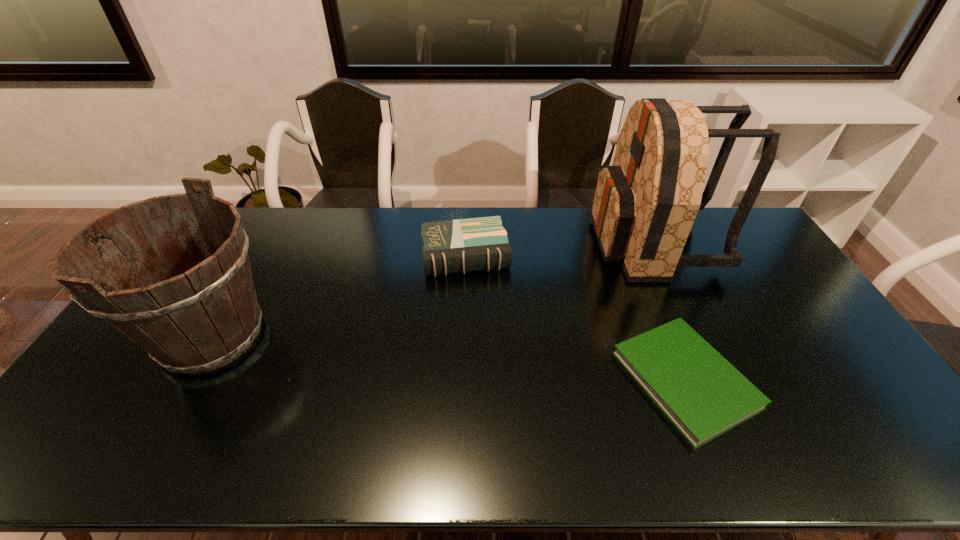
Identify the location of vacant space in between the tallest object and the bucket. (432, 289).

Where is `empty location between the right paperback book and the left paperback book`? This screenshot has height=540, width=960. empty location between the right paperback book and the left paperback book is located at coordinates (576, 317).

Locate an element on the screen. The image size is (960, 540). unoccupied position between the second tallest object and the second shortest object is located at coordinates point(339,295).

Identify the location of vacant region between the second tallest object and the right paperback book. (448, 357).

Where is `blank region between the bucket and the backpack`? blank region between the bucket and the backpack is located at coordinates (432, 289).

Identify the location of free space between the tallest object and the leftmost object. The image size is (960, 540). (432, 289).

Where is `unoccupied position between the second tallest object and the tallest object`? This screenshot has height=540, width=960. unoccupied position between the second tallest object and the tallest object is located at coordinates (432, 289).

Locate an element on the screen. vacant area between the leftmost object and the left paperback book is located at coordinates (339, 295).

Where is `vacant region between the second shortest object and the leftmost object`? vacant region between the second shortest object and the leftmost object is located at coordinates (339, 295).

Where is `object that can be found as the second closest to the backpack`? The width and height of the screenshot is (960, 540). object that can be found as the second closest to the backpack is located at coordinates (463, 245).